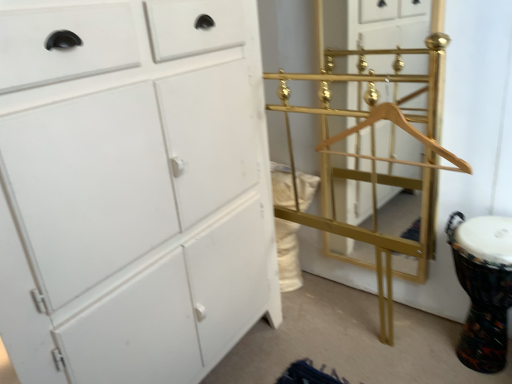
Question: Is gold metallic coat rack at center at the left side of gold metallic bunk bed at right?

Choices:
 (A) yes
 (B) no

Answer: (A)

Question: Is gold metallic coat rack at center in front of gold metallic bunk bed at right?

Choices:
 (A) yes
 (B) no

Answer: (B)

Question: Does gold metallic coat rack at center touch gold metallic bunk bed at right?

Choices:
 (A) yes
 (B) no

Answer: (B)

Question: Does gold metallic coat rack at center lie behind gold metallic bunk bed at right?

Choices:
 (A) yes
 (B) no

Answer: (A)

Question: From a real-world perspective, is gold metallic coat rack at center beneath gold metallic bunk bed at right?

Choices:
 (A) no
 (B) yes

Answer: (A)

Question: Does gold metallic coat rack at center appear on the right side of gold metallic bunk bed at right?

Choices:
 (A) no
 (B) yes

Answer: (A)

Question: Is gold metallic bunk bed at right with white matte cabinet at left?

Choices:
 (A) yes
 (B) no

Answer: (B)

Question: From the image's perspective, is gold metallic bunk bed at right located above white matte cabinet at left?

Choices:
 (A) yes
 (B) no

Answer: (A)

Question: From the image's perspective, is gold metallic bunk bed at right located beneath white matte cabinet at left?

Choices:
 (A) no
 (B) yes

Answer: (A)

Question: Considering the relative sizes of gold metallic bunk bed at right and white matte cabinet at left in the image provided, is gold metallic bunk bed at right shorter than white matte cabinet at left?

Choices:
 (A) yes
 (B) no

Answer: (A)

Question: Can you confirm if gold metallic bunk bed at right is wider than white matte cabinet at left?

Choices:
 (A) yes
 (B) no

Answer: (B)

Question: From a real-world perspective, does gold metallic bunk bed at right sit lower than white matte cabinet at left?

Choices:
 (A) yes
 (B) no

Answer: (A)

Question: Considering the relative positions of gold metallic coat rack at center and white matte cabinet at left in the image provided, is gold metallic coat rack at center to the left of white matte cabinet at left from the viewer's perspective?

Choices:
 (A) yes
 (B) no

Answer: (B)